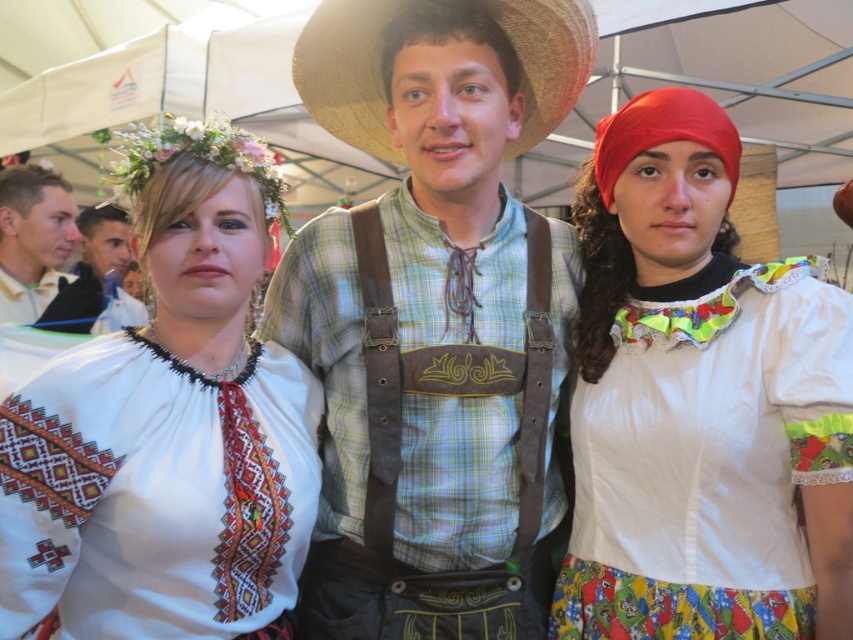
You are a photographer at the event and need to ensure all participants are visible in the photo. The green plaid shirt at center and the white embroidered blouse at center are both in your frame. Which one appears higher in the photo?

The green plaid shirt at center appears higher in the photo because it is located above the white embroidered blouse at center according to the description.

You are a photographer at the event and need to capture a clear photo of both the white embroidered blouse at center and the smooth white shirt at left. Based on their positions, which one is closer to the camera?

The white embroidered blouse at center is closer to the camera because it is in front of the smooth white shirt at left.